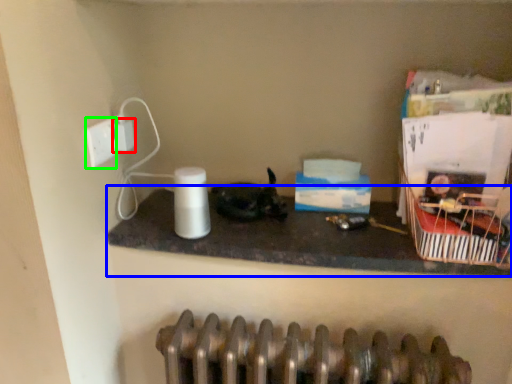
Question: Considering the real-world distances, which object is closest to electric outlet (highlighted by a red box)? counter top (highlighted by a blue box) or socket (highlighted by a green box).

Choices:
 (A) counter top
 (B) socket

Answer: (B)